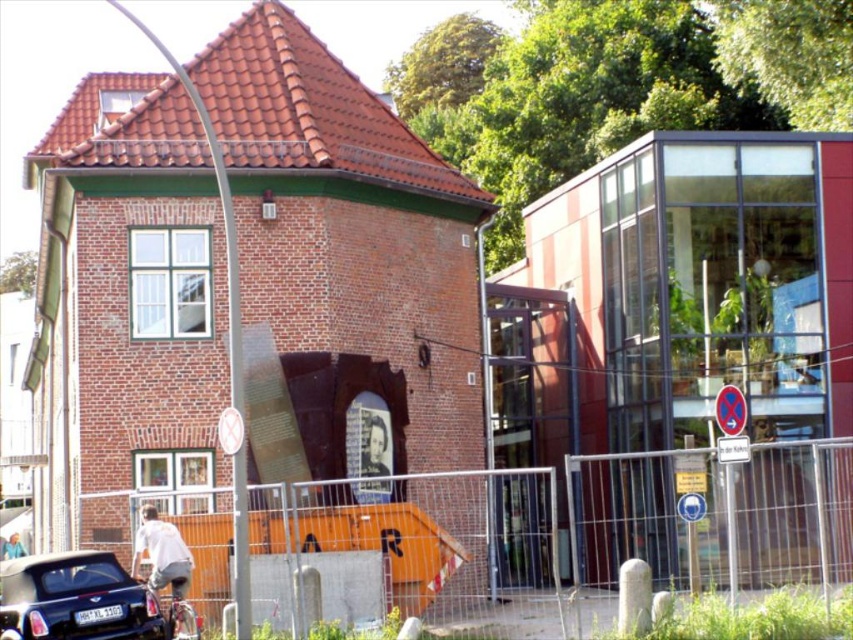
Question: Can you confirm if metal fence at lower left is positioned above shiny black car at lower left?

Choices:
 (A) yes
 (B) no

Answer: (B)

Question: Is metal fence at lower left to the right of shiny black car at lower left from the viewer's perspective?

Choices:
 (A) no
 (B) yes

Answer: (B)

Question: Which object is closer to the camera taking this photo?

Choices:
 (A) metal fence at lower left
 (B) shiny black car at lower left

Answer: (B)

Question: Can you confirm if metal fence at lower left is wider than shiny black car at lower left?

Choices:
 (A) no
 (B) yes

Answer: (B)

Question: Which point appears farthest from the camera in this image?

Choices:
 (A) (111, 612)
 (B) (805, 548)

Answer: (B)